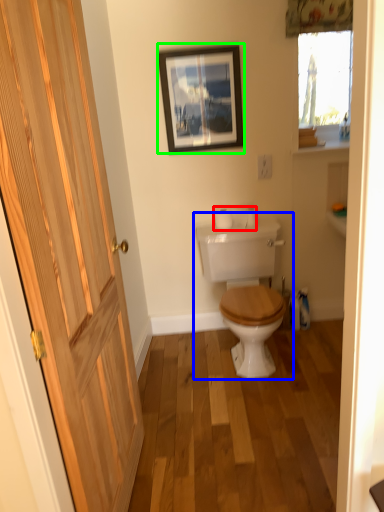
Question: Which object is the farthest from toilet paper (highlighted by a red box)? Choose among these: toilet (highlighted by a blue box) or picture frame (highlighted by a green box).

Choices:
 (A) toilet
 (B) picture frame

Answer: (B)